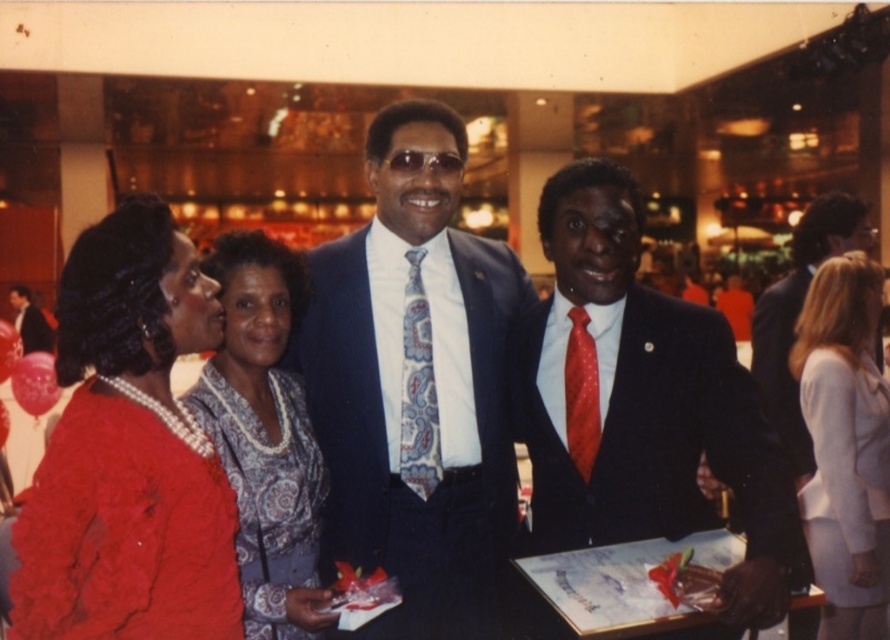
Between blue satin suit at center and matte black suit at right, which one has more height?

With more height is blue satin suit at center.

Can you confirm if blue satin suit at center is bigger than matte black suit at right?

No.

Where is `blue satin suit at center`? The width and height of the screenshot is (890, 640). blue satin suit at center is located at coordinates (414, 385).

Who is positioned more to the left, shiny black suit at center or white satin dress at lower right?

From the viewer's perspective, shiny black suit at center appears more on the left side.

Is shiny black suit at center bigger than white satin dress at lower right?

Correct, shiny black suit at center is larger in size than white satin dress at lower right.

Is point (557, 449) positioned in front of point (807, 323)?

Yes, it is in front of point (807, 323).

The image size is (890, 640). I want to click on shiny black suit at center, so pos(641,404).

In the scene shown: Is shiny black suit at center thinner than patterned fabric dress at center?

In fact, shiny black suit at center might be wider than patterned fabric dress at center.

Is point (577, 237) behind point (253, 371)?

No, it is in front of (253, 371).

Measure the distance between shiny black suit at center and camera.

A distance of 1.49 meters exists between shiny black suit at center and camera.

I want to click on shiny black suit at center, so click(x=641, y=404).